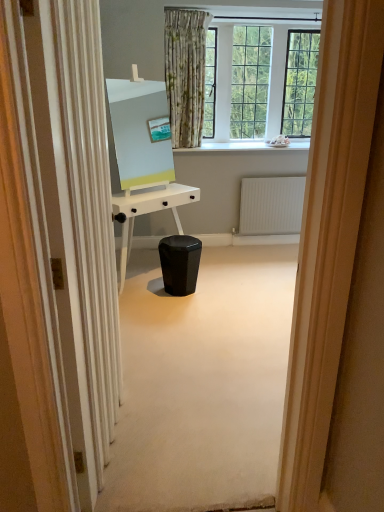
Identify the location of free space between white glossy screen door at left and black glossy music stool at center. (157, 361).